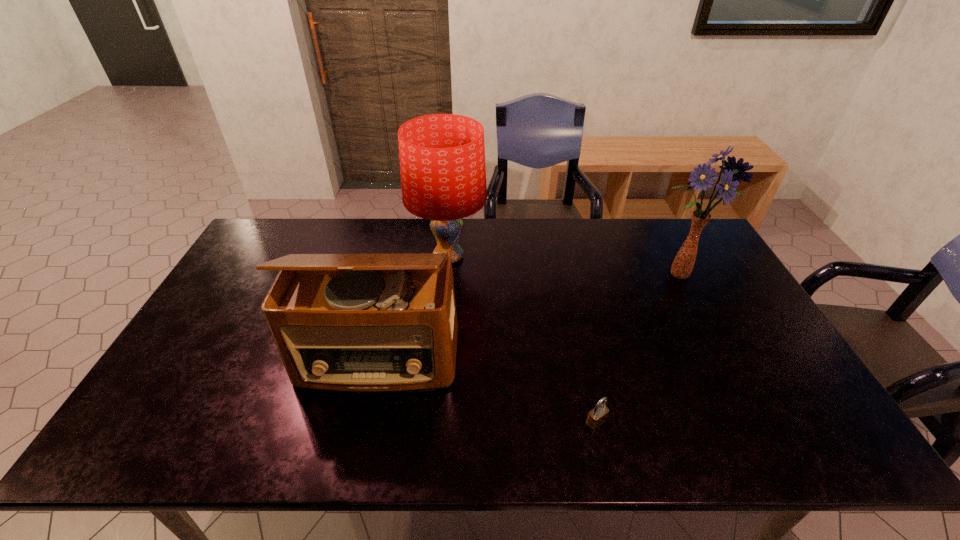
At what (x,y) coordinates should I click in order to perform the action: click on object that is at the far edge. Please return your answer as a coordinate pair (x, y). The image size is (960, 540). Looking at the image, I should click on (442, 156).

At what (x,y) coordinates should I click in order to perform the action: click on object located at the near edge. Please return your answer as a coordinate pair (x, y). Image resolution: width=960 pixels, height=540 pixels. Looking at the image, I should click on (597, 416).

The height and width of the screenshot is (540, 960). What are the coordinates of `object present at the right edge` in the screenshot? It's located at (682, 266).

You are a GUI agent. You are given a task and a screenshot of the screen. Output one action in this format:
    pyautogui.click(x=<x>, y=<y>)
    Task: Click on the vacant area at the far edge
    
    Given the screenshot: What is the action you would take?
    pyautogui.click(x=632, y=230)

In the image, there is a desktop. Where is `vacant area at the left edge`? The height and width of the screenshot is (540, 960). vacant area at the left edge is located at coordinates (160, 412).

Where is `vacant space at the right edge of the desktop`? This screenshot has width=960, height=540. vacant space at the right edge of the desktop is located at coordinates (722, 338).

Locate an element on the screen. The height and width of the screenshot is (540, 960). free space at the far left corner of the desktop is located at coordinates (301, 228).

At what (x,y) coordinates should I click in order to perform the action: click on free spot at the near right corner of the desktop. Please return your answer as a coordinate pair (x, y). Looking at the image, I should click on (822, 437).

Where is `free space that is in between the lampshade and the padlock`? free space that is in between the lampshade and the padlock is located at coordinates (522, 340).

The height and width of the screenshot is (540, 960). I want to click on free space between the flower arrangement and the second nearest object, so click(528, 317).